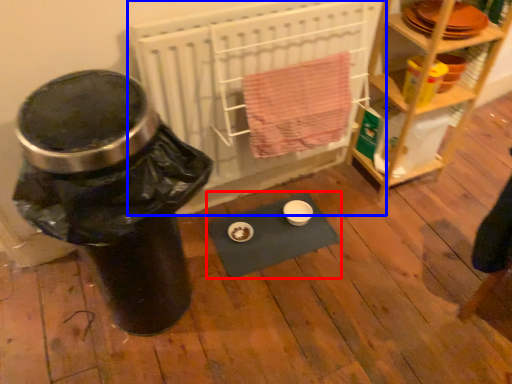
Question: Among these objects, which one is nearest to the camera, yoga mat (highlighted by a red box) or wide (highlighted by a blue box)?

Choices:
 (A) yoga mat
 (B) wide

Answer: (B)